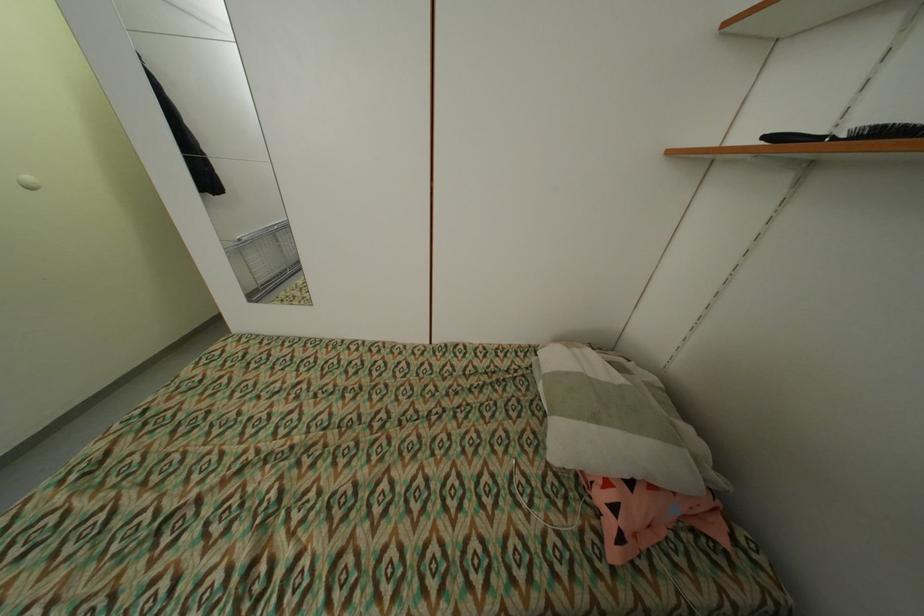
Which object does [649,515] point to?

This point indicates the pink patterned pillow.